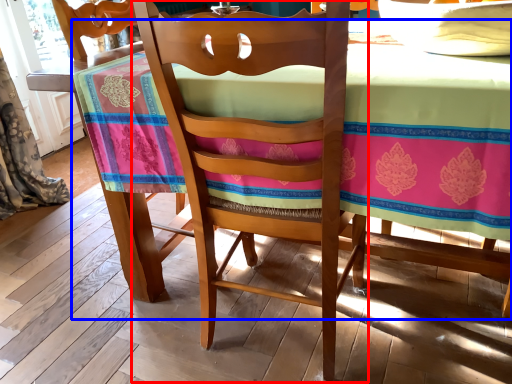
Question: Among these objects, which one is farthest to the camera, chair (highlighted by a red box) or table (highlighted by a blue box)?

Choices:
 (A) chair
 (B) table

Answer: (A)